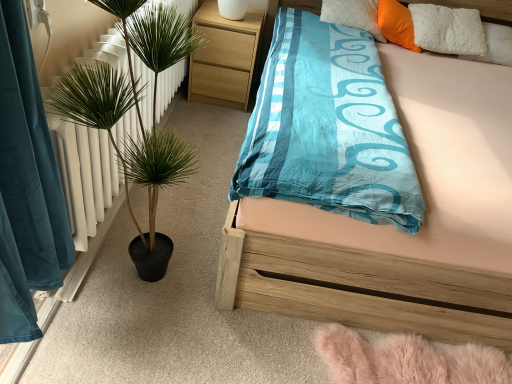
The width and height of the screenshot is (512, 384). What do you see at coordinates (396, 24) in the screenshot?
I see `orange plush pillow at upper right` at bounding box center [396, 24].

Describe the element at coordinates (224, 57) in the screenshot. I see `light wood/texture nightstand at upper center` at that location.

Locate an element on the screen. green leafy plant in pot at left is located at coordinates (89, 158).

Consider the image. From the image's perspective, between light wood/texture nightstand at upper center and orange plush pillow at upper right, which one is located above?

orange plush pillow at upper right appears higher in the image.

Is light wood/texture nightstand at upper center thinner than orange plush pillow at upper right?

Incorrect, the width of light wood/texture nightstand at upper center is not less than that of orange plush pillow at upper right.

How different are the orientations of light wood/texture nightstand at upper center and orange plush pillow at upper right in degrees?

The angle between the facing direction of light wood/texture nightstand at upper center and the facing direction of orange plush pillow at upper right is 53.7 degrees.

Considering the relative sizes of green leafy plant in pot at left and orange plush pillow at upper right in the image provided, is green leafy plant in pot at left taller than orange plush pillow at upper right?

Indeed, green leafy plant in pot at left has a greater height compared to orange plush pillow at upper right.

Is green leafy plant in pot at left looking in the opposite direction of orange plush pillow at upper right?

That's not correct — green leafy plant in pot at left is not looking away from orange plush pillow at upper right.

There is a green leafy plant in pot at left. Find the location of `pillow above it (from a real-world perspective)`. pillow above it (from a real-world perspective) is located at coordinates pos(396,24).

Are wooden bed at center and green leafy plant in pot at left far apart?

wooden bed at center is actually quite close to green leafy plant in pot at left.

From the image's perspective, is wooden bed at center on green leafy plant in pot at left?

Correct, wooden bed at center appears higher than green leafy plant in pot at left in the image.

Locate an element on the screen. houseplant located on the left of wooden bed at center is located at coordinates (89, 158).

Is orange plush pillow at upper right smaller than light wood/texture nightstand at upper center?

Yes.

From the image's perspective, does orange plush pillow at upper right appear lower than light wood/texture nightstand at upper center?

Actually, orange plush pillow at upper right appears above light wood/texture nightstand at upper center in the image.

Looking at this image, between orange plush pillow at upper right and light wood/texture nightstand at upper center, which one is positioned behind?

light wood/texture nightstand at upper center is more distant.

How many degrees apart are the facing directions of orange plush pillow at upper right and light wood/texture nightstand at upper center?

They differ by 53.7 degrees in their facing directions.

From a real-world perspective, is green leafy plant in pot at left above or below wooden bed at center?

green leafy plant in pot at left is above wooden bed at center.

Who is more distant, green leafy plant in pot at left or wooden bed at center?

wooden bed at center is further away from the camera.

Does green leafy plant in pot at left have a larger size compared to wooden bed at center?

No.

Looking at this image, from a real-world perspective, which is physically below, green leafy plant in pot at left or light wood/texture nightstand at upper center?

From a 3D spatial view, light wood/texture nightstand at upper center is below.

Where is `nightstand lying on the right of green leafy plant in pot at left`? nightstand lying on the right of green leafy plant in pot at left is located at coordinates (224, 57).

Between green leafy plant in pot at left and light wood/texture nightstand at upper center, which one is positioned behind?

light wood/texture nightstand at upper center is further away from the camera.

From a real-world perspective, which object stands above the other?

wooden bed at center, from a real-world perspective.

How much distance is there between light wood/texture nightstand at upper center and wooden bed at center?

The distance of light wood/texture nightstand at upper center from wooden bed at center is 4.22 feet.

Is light wood/texture nightstand at upper center directly adjacent to wooden bed at center?

light wood/texture nightstand at upper center and wooden bed at center are not in contact.

Locate an element on the screen. The image size is (512, 384). bed that appears above the light wood/texture nightstand at upper center (from a real-world perspective) is located at coordinates (362, 274).

At what (x,y) coordinates should I click in order to perform the action: click on pillow in front of the light wood/texture nightstand at upper center. Please return your answer as a coordinate pair (x, y). The height and width of the screenshot is (384, 512). Looking at the image, I should click on (396, 24).

What are the coordinates of `pillow above the green leafy plant in pot at left (from the image's perspective)` in the screenshot? It's located at (396, 24).

Which object lies further to the anchor point green leafy plant in pot at left, orange plush pillow at upper right or wooden bed at center?

orange plush pillow at upper right lies further to green leafy plant in pot at left than the other object.

Based on the photo, considering their positions, is green leafy plant in pot at left positioned closer to light wood/texture nightstand at upper center than wooden bed at center?

The object closer to light wood/texture nightstand at upper center is green leafy plant in pot at left.

Which object lies further to the anchor point orange plush pillow at upper right, green leafy plant in pot at left or light wood/texture nightstand at upper center?

Based on the image, green leafy plant in pot at left appears to be further to orange plush pillow at upper right.

When comparing their distances from green leafy plant in pot at left, does light wood/texture nightstand at upper center or orange plush pillow at upper right seem closer?

light wood/texture nightstand at upper center.

When comparing their distances from wooden bed at center, does orange plush pillow at upper right or green leafy plant in pot at left seem closer?

green leafy plant in pot at left is positioned closer to the anchor wooden bed at center.

Considering their positions, is wooden bed at center positioned further to orange plush pillow at upper right than green leafy plant in pot at left?

green leafy plant in pot at left is further to orange plush pillow at upper right.

Estimate the real-world distances between objects in this image. Which object is closer to light wood/texture nightstand at upper center, orange plush pillow at upper right or wooden bed at center?

orange plush pillow at upper right is positioned closer to the anchor light wood/texture nightstand at upper center.

Which object lies nearer to the anchor point orange plush pillow at upper right, light wood/texture nightstand at upper center or green leafy plant in pot at left?

Among the two, light wood/texture nightstand at upper center is located nearer to orange plush pillow at upper right.

Locate an element on the screen. Image resolution: width=512 pixels, height=384 pixels. pillow between green leafy plant in pot at left and light wood/texture nightstand at upper center along the z-axis is located at coordinates (396, 24).

Locate an element on the screen. This screenshot has width=512, height=384. pillow between wooden bed at center and light wood/texture nightstand at upper center along the z-axis is located at coordinates (396, 24).

Identify the location of bed between green leafy plant in pot at left and orange plush pillow at upper right in the front-back direction. The image size is (512, 384). (362, 274).

Identify the location of bed located between green leafy plant in pot at left and light wood/texture nightstand at upper center in the depth direction. (362, 274).